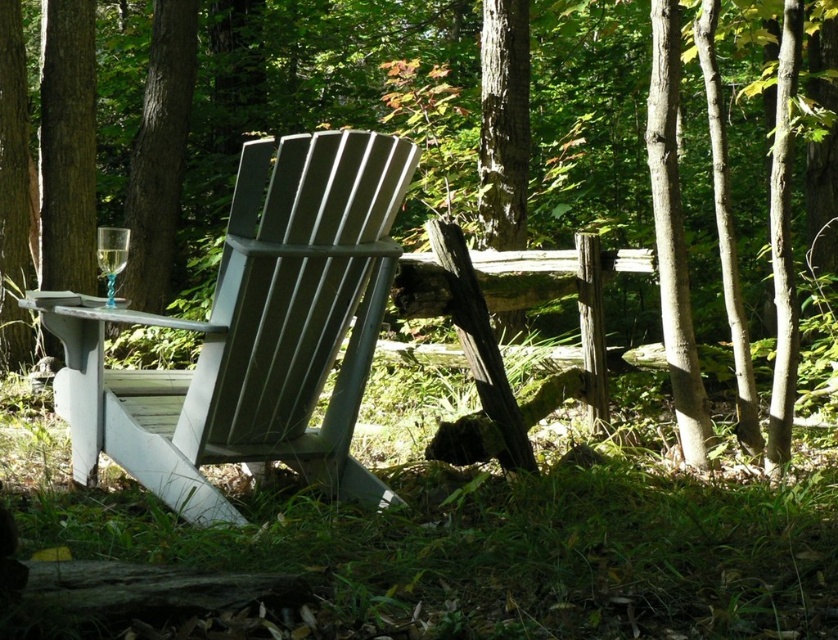
Measure the distance from matte gray wood chair at center to green textured tree trunk at upper left.

A distance of 14.80 feet exists between matte gray wood chair at center and green textured tree trunk at upper left.

Can you confirm if matte gray wood chair at center is smaller than green textured tree trunk at upper left?

No, matte gray wood chair at center is not smaller than green textured tree trunk at upper left.

In order to click on matte gray wood chair at center in this screenshot , I will do `click(252, 332)`.

Does matte gray wood chair at center appear on the right side of clear glass wine glass at left?

Yes, matte gray wood chair at center is to the right of clear glass wine glass at left.

Can you confirm if matte gray wood chair at center is shorter than clear glass wine glass at left?

Incorrect, matte gray wood chair at center's height does not fall short of clear glass wine glass at left's.

Which is in front, point (350, 362) or point (122, 232)?

Point (350, 362) is more forward.

Find the location of a particular element. matte gray wood chair at center is located at coordinates click(252, 332).

Between point (132, 268) and point (120, 257), which one is positioned in front?

Point (120, 257) is more forward.

How much distance is there between green textured tree trunk at upper left and clear glass wine glass at left?

3.93 meters

Does point (149, 259) come closer to viewer compared to point (107, 234)?

No, it is behind (107, 234).

You are a GUI agent. You are given a task and a screenshot of the screen. Output one action in this format:
    pyautogui.click(x=<x>, y=<y>)
    Task: Click on the green textured tree trunk at upper left
    This screenshot has height=640, width=838.
    Given the screenshot: What is the action you would take?
    pyautogui.click(x=159, y=154)